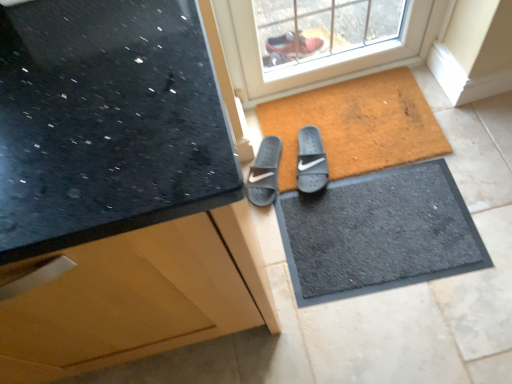
This screenshot has height=384, width=512. Find the location of `matte black countertop at upper left`. matte black countertop at upper left is located at coordinates (116, 189).

Describe the element at coordinates (378, 233) in the screenshot. This screenshot has width=512, height=384. I see `black rubber doormat at center` at that location.

What do you see at coordinates (311, 161) in the screenshot?
I see `gray rubber slide at center, the 1th footwear in the right-to-left sequence` at bounding box center [311, 161].

From the picture: Measure the distance between gray rubber slide at center, which is the 1th footwear in left-to-right order, and camera.

gray rubber slide at center, which is the 1th footwear in left-to-right order, is 1.44 meters from camera.

Locate an element on the screen. gray rubber slide at center, the 2th footwear positioned from the right is located at coordinates (265, 173).

Identify the location of brown textured mat at center. The image size is (512, 384). click(357, 125).

You are a GUI agent. You are given a task and a screenshot of the screen. Output one action in this format:
    pyautogui.click(x=<x>, y=<y>)
    Task: Click on the mat behind the gray rubber slide at center, the 1th footwear in the right-to-left sequence
    The width and height of the screenshot is (512, 384).
    Given the screenshot: What is the action you would take?
    pyautogui.click(x=357, y=125)

Is gray rubber slide at center, the 1th footwear in the right-to-left sequence, next to brown textured mat at center?

They are not placed beside each other.

Looking at this image, is matte black countertop at upper left facing away from gray rubber slide at center, the 1th footwear in the right-to-left sequence?

No, matte black countertop at upper left is not facing away from gray rubber slide at center, the 1th footwear in the right-to-left sequence.

From the image's perspective, between matte black countertop at upper left and gray rubber slide at center, the 1th footwear in the right-to-left sequence, which one is located above?

gray rubber slide at center, the 1th footwear in the right-to-left sequence.

From a real-world perspective, is matte black countertop at upper left over gray rubber slide at center, the 1th footwear in the right-to-left sequence?

Yes, from a real-world perspective, matte black countertop at upper left is over gray rubber slide at center, the 1th footwear in the right-to-left sequence

At what (x,y) coordinates should I click in order to perform the action: click on the 1st footwear behind the matte black countertop at upper left, counting from the anchor's position. Please return your answer as a coordinate pair (x, y). This screenshot has height=384, width=512. Looking at the image, I should click on (311, 161).

Is matte black countertop at upper left bigger than black rubber doormat at center?

Yes, matte black countertop at upper left is bigger than black rubber doormat at center.

Between matte black countertop at upper left and black rubber doormat at center, which one has less height?

black rubber doormat at center is shorter.

Choose the correct answer: Is matte black countertop at upper left inside black rubber doormat at center or outside it?

matte black countertop at upper left cannot be found inside black rubber doormat at center.

Is brown textured mat at center positioned far away from black rubber doormat at center?

That's not correct — brown textured mat at center is a little close to black rubber doormat at center.

Is brown textured mat at center thinner than black rubber doormat at center?

In fact, brown textured mat at center might be wider than black rubber doormat at center.

How distant is brown textured mat at center from black rubber doormat at center?

A distance of 22.01 centimeters exists between brown textured mat at center and black rubber doormat at center.

Is black rubber doormat at center at the back of brown textured mat at center?

No, brown textured mat at center is not facing the opposite direction of black rubber doormat at center.

From a real-world perspective, is gray rubber slide at center, the 1th footwear in the right-to-left sequence, positioned above or below black rubber doormat at center?

From a real-world perspective, gray rubber slide at center, the 1th footwear in the right-to-left sequence, is physically above black rubber doormat at center.

From the image's perspective, would you say gray rubber slide at center, which ranks as the 2th footwear in left-to-right order, is positioned over black rubber doormat at center?

Indeed, from the image's perspective, gray rubber slide at center, which ranks as the 2th footwear in left-to-right order, is shown above black rubber doormat at center.

Consider the image. Is the depth of gray rubber slide at center, which ranks as the 2th footwear in left-to-right order, greater than that of black rubber doormat at center?

That is True.

Are gray rubber slide at center, the 1th footwear in the right-to-left sequence, and black rubber doormat at center located far from each other?

Actually, gray rubber slide at center, the 1th footwear in the right-to-left sequence, and black rubber doormat at center are a little close together.

Could you tell me if black rubber doormat at center is facing gray rubber slide at center, which is the 1th footwear in left-to-right order?

No.

Can you confirm if black rubber doormat at center is positioned to the right of gray rubber slide at center, the 2th footwear positioned from the right?

Correct, you'll find black rubber doormat at center to the right of gray rubber slide at center, the 2th footwear positioned from the right.

Does black rubber doormat at center come behind gray rubber slide at center, which is the 1th footwear in left-to-right order?

No.

Is black rubber doormat at center taller than brown textured mat at center?

Incorrect, the height of black rubber doormat at center is not larger of that of brown textured mat at center.

Is black rubber doormat at center turned away from brown textured mat at center?

Absolutely, black rubber doormat at center is directed away from brown textured mat at center.

From the image's perspective, which one is positioned lower, black rubber doormat at center or brown textured mat at center?

From the image's view, black rubber doormat at center is below.

At what (x,y) coordinates should I click in order to perform the action: click on mat below the gray rubber slide at center, the 1th footwear in the right-to-left sequence (from a real-world perspective). Please return your answer as a coordinate pair (x, y). The image size is (512, 384). Looking at the image, I should click on (357, 125).

Identify the location of cabinetry that appears on the left of gray rubber slide at center, which ranks as the 2th footwear in left-to-right order. The height and width of the screenshot is (384, 512). (116, 189).

When comparing their distances from matte black countertop at upper left, does black rubber doormat at center or gray rubber slide at center, which is the 1th footwear in left-to-right order, seem closer?

black rubber doormat at center lies closer to matte black countertop at upper left than the other object.

Considering their positions, is gray rubber slide at center, the 2th footwear positioned from the right, positioned closer to matte black countertop at upper left than gray rubber slide at center, the 1th footwear in the right-to-left sequence?

Among the two, gray rubber slide at center, the 2th footwear positioned from the right, is located nearer to matte black countertop at upper left.

When comparing their distances from gray rubber slide at center, which is the 1th footwear in left-to-right order, does matte black countertop at upper left or brown textured mat at center seem closer?

The object closer to gray rubber slide at center, which is the 1th footwear in left-to-right order, is brown textured mat at center.

Looking at this image, considering their positions, is brown textured mat at center positioned closer to gray rubber slide at center, which ranks as the 2th footwear in left-to-right order, than gray rubber slide at center, the 2th footwear positioned from the right?

Among the two, gray rubber slide at center, the 2th footwear positioned from the right, is located nearer to gray rubber slide at center, which ranks as the 2th footwear in left-to-right order.

Consider the image. Which object lies further to the anchor point brown textured mat at center, matte black countertop at upper left or black rubber doormat at center?

matte black countertop at upper left is further to brown textured mat at center.

When comparing their distances from brown textured mat at center, does gray rubber slide at center, the 2th footwear positioned from the right, or black rubber doormat at center seem further?

gray rubber slide at center, the 2th footwear positioned from the right.

Considering their positions, is gray rubber slide at center, which is the 1th footwear in left-to-right order, positioned closer to black rubber doormat at center than matte black countertop at upper left?

gray rubber slide at center, which is the 1th footwear in left-to-right order, lies closer to black rubber doormat at center than the other object.

Which object lies nearer to the anchor point gray rubber slide at center, which is the 1th footwear in left-to-right order, gray rubber slide at center, which ranks as the 2th footwear in left-to-right order, or brown textured mat at center?

gray rubber slide at center, which ranks as the 2th footwear in left-to-right order.

I want to click on doormat positioned between matte black countertop at upper left and brown textured mat at center from near to far, so click(x=378, y=233).

Locate an element on the screen. mat between gray rubber slide at center, which is the 1th footwear in left-to-right order, and black rubber doormat at center from left to right is located at coordinates (357, 125).

You are a GUI agent. You are given a task and a screenshot of the screen. Output one action in this format:
    pyautogui.click(x=<x>, y=<y>)
    Task: Click on the footwear between gray rubber slide at center, which is the 1th footwear in left-to-right order, and brown textured mat at center
    
    Given the screenshot: What is the action you would take?
    pyautogui.click(x=311, y=161)

Locate an element on the screen. The width and height of the screenshot is (512, 384). doormat located between matte black countertop at upper left and gray rubber slide at center, which is the 1th footwear in left-to-right order, in the depth direction is located at coordinates (378, 233).